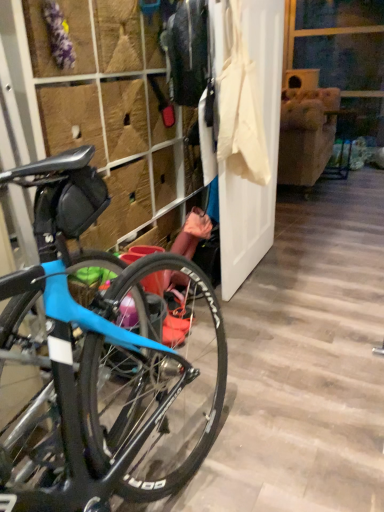
Question: Is blue matte bicycle at left closer to the viewer compared to white fabric screen door at center?

Choices:
 (A) no
 (B) yes

Answer: (B)

Question: Does blue matte bicycle at left have a larger size compared to white fabric screen door at center?

Choices:
 (A) yes
 (B) no

Answer: (A)

Question: Considering the relative sizes of blue matte bicycle at left and white fabric screen door at center in the image provided, is blue matte bicycle at left wider than white fabric screen door at center?

Choices:
 (A) yes
 (B) no

Answer: (A)

Question: Is blue matte bicycle at left outside white fabric screen door at center?

Choices:
 (A) yes
 (B) no

Answer: (A)

Question: Is blue matte bicycle at left oriented away from white fabric screen door at center?

Choices:
 (A) no
 (B) yes

Answer: (B)

Question: Is blue matte bicycle at left at the left side of white fabric screen door at center?

Choices:
 (A) yes
 (B) no

Answer: (A)

Question: Is white fabric screen door at center facing towards blue matte bicycle at left?

Choices:
 (A) no
 (B) yes

Answer: (A)

Question: Is blue matte bicycle at left at the back of white fabric screen door at center?

Choices:
 (A) yes
 (B) no

Answer: (A)

Question: Is white fabric screen door at center bigger than blue matte bicycle at left?

Choices:
 (A) yes
 (B) no

Answer: (B)

Question: From a real-world perspective, is white fabric screen door at center under blue matte bicycle at left?

Choices:
 (A) no
 (B) yes

Answer: (B)

Question: From the image's perspective, is white fabric screen door at center beneath blue matte bicycle at left?

Choices:
 (A) yes
 (B) no

Answer: (B)

Question: Is white fabric screen door at center in front of blue matte bicycle at left?

Choices:
 (A) yes
 (B) no

Answer: (B)

Question: Looking at the image, does white fabric screen door at center seem bigger or smaller compared to blue matte bicycle at left?

Choices:
 (A) small
 (B) big

Answer: (A)